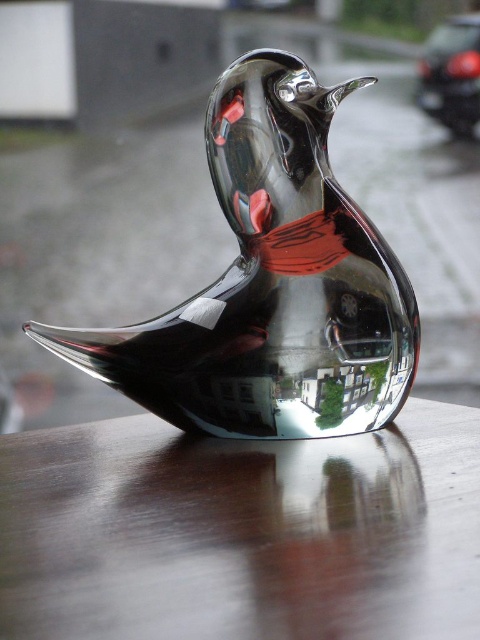
Question: Which point is farther to the camera?

Choices:
 (A) shiny metallic bird at center
 (B) glossy wood table at center

Answer: (A)

Question: Which object is closer to the camera taking this photo?

Choices:
 (A) shiny metallic bird at center
 (B) glossy wood table at center

Answer: (B)

Question: Is glossy wood table at center to the left of shiny metallic bird at center from the viewer's perspective?

Choices:
 (A) yes
 (B) no

Answer: (B)

Question: Can you confirm if glossy wood table at center is positioned below shiny metallic bird at center?

Choices:
 (A) yes
 (B) no

Answer: (A)

Question: Which object appears farthest from the camera in this image?

Choices:
 (A) shiny metallic bird at center
 (B) glossy wood table at center

Answer: (A)

Question: Is glossy wood table at center below shiny metallic bird at center?

Choices:
 (A) no
 (B) yes

Answer: (B)